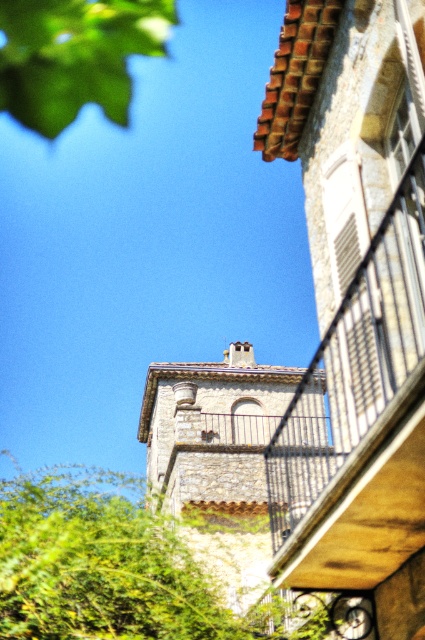
Question: Which object is positioned farthest from the stone textured bell tower at center?

Choices:
 (A) green leafy tree at upper left
 (B) green leafy tree at lower left

Answer: (A)

Question: Which point appears farthest from the camera in this image?

Choices:
 (A) [155, 532]
 (B) [209, 444]
 (C) [147, 45]

Answer: (C)

Question: Which is nearer to the stone textured bell tower at center?

Choices:
 (A) green leafy tree at lower left
 (B) green leafy tree at upper left

Answer: (A)

Question: Does green leafy tree at lower left have a greater width compared to green leafy tree at upper left?

Choices:
 (A) no
 (B) yes

Answer: (B)

Question: Is green leafy tree at lower left behind green leafy tree at upper left?

Choices:
 (A) no
 (B) yes

Answer: (A)

Question: In this image, where is stone textured bell tower at center located relative to green leafy tree at upper left?

Choices:
 (A) below
 (B) above

Answer: (A)